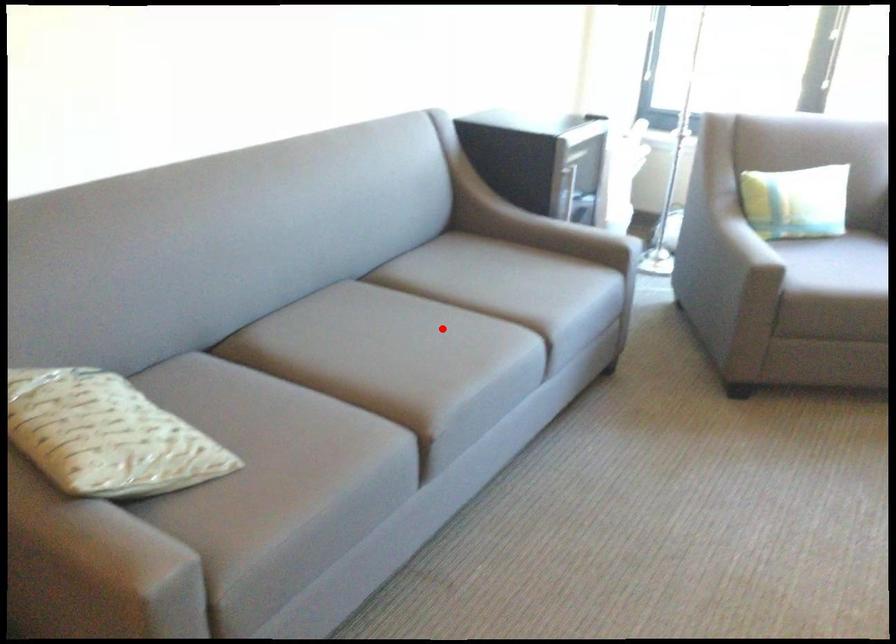
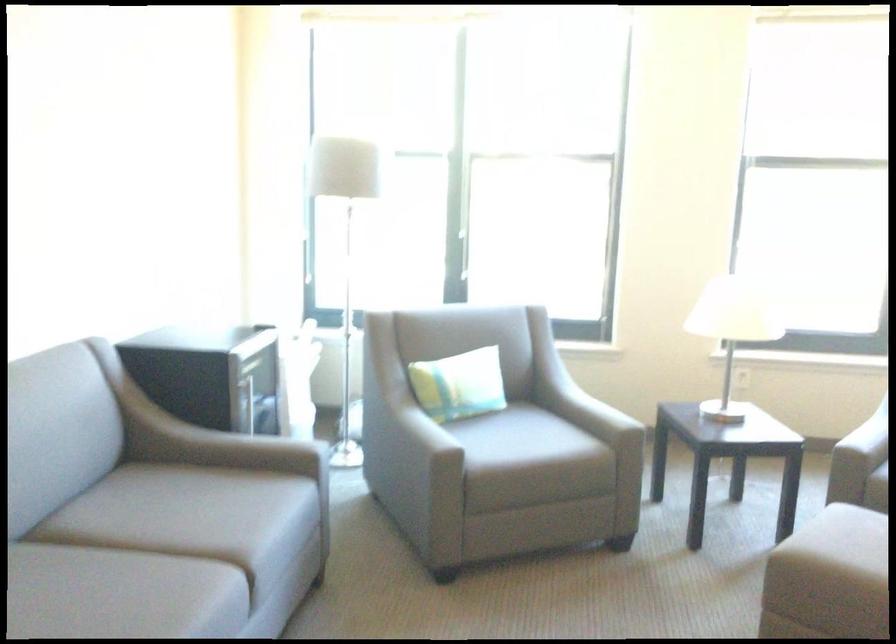
Question: I am providing you with two images of the same scene from different viewpoints. Given a red point in image1, look at the same physical point in image2. Is it:

Choices:
 (A) Closer to the viewpoint
 (B) Farther from the viewpoint

Answer: (A)